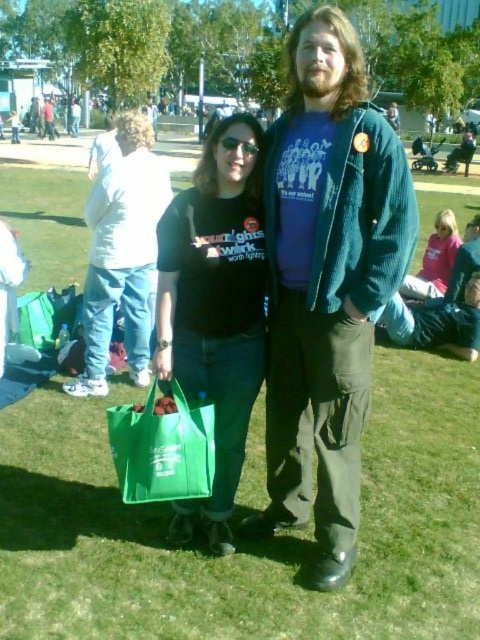
Question: Is corduroy jacket at center positioned behind matte black shirt at center?

Choices:
 (A) yes
 (B) no

Answer: (B)

Question: Which point is closer to the camera taking this photo?

Choices:
 (A) (52, 128)
 (B) (130, 305)
 (C) (236, 204)

Answer: (C)

Question: From the image, what is the correct spatial relationship of black matte t-shirt at center in relation to matte black shirt at center?

Choices:
 (A) above
 (B) below

Answer: (B)

Question: Estimate the real-world distances between objects in this image. Which object is farther from the corduroy jacket at center?

Choices:
 (A) matte black shirt at center
 (B) black matte t-shirt at center
 (C) green fabric bag at lower left
 (D) pink fabric shirt at upper right

Answer: (D)

Question: Which point appears farthest from the camera in this image?

Choices:
 (A) (134, 260)
 (B) (48, 131)
 (C) (435, 234)
 (D) (192, 316)

Answer: (B)

Question: Does black matte t-shirt at center have a greater width compared to matte white shirt at upper left?

Choices:
 (A) yes
 (B) no

Answer: (B)